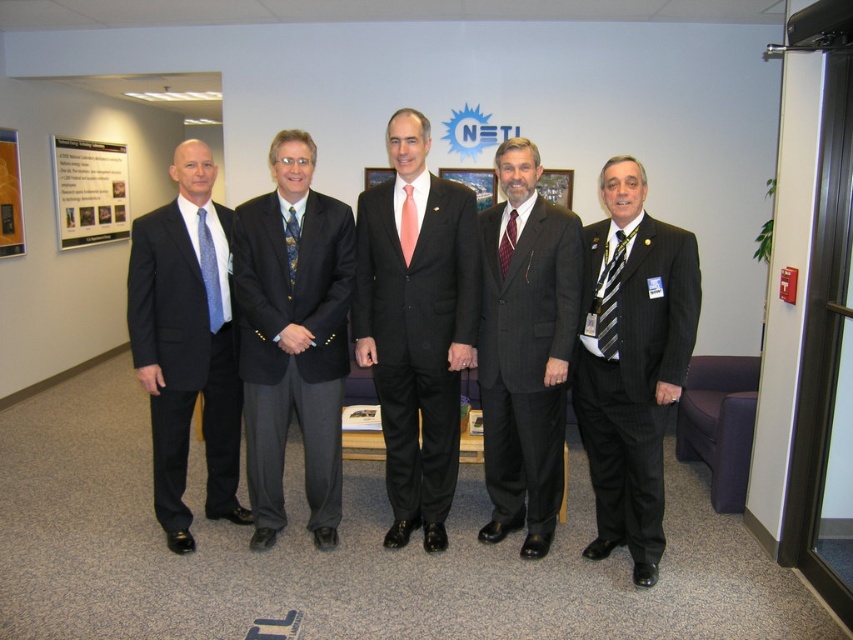
Does dark gray pinstripe suit at center have a lesser width compared to matte black suit at left?

Yes.

Between point (524, 230) and point (138, 305), which one is positioned behind?

The point (138, 305) is behind.

Find the location of a particular element. dark gray pinstripe suit at center is located at coordinates (526, 349).

Is point (634, 172) positioned before point (521, 211)?

Yes, point (634, 172) is closer to viewer.

The image size is (853, 640). In order to click on pinstripe suit at right in this screenshot , I will do `click(631, 362)`.

Does point (637, 237) come closer to viewer compared to point (537, 376)?

Yes, point (637, 237) is closer to viewer.

At what (x,y) coordinates should I click in order to perform the action: click on pinstripe suit at right. Please return your answer as a coordinate pair (x, y). This screenshot has height=640, width=853. Looking at the image, I should click on (631, 362).

Is point (392, 145) positioned in front of point (206, 248)?

Yes, point (392, 145) is in front of point (206, 248).

Where is `matte black suit at center`? Image resolution: width=853 pixels, height=640 pixels. matte black suit at center is located at coordinates (416, 326).

You are a GUI agent. You are given a task and a screenshot of the screen. Output one action in this format:
    pyautogui.click(x=<x>, y=<y>)
    Task: Click on the matte black suit at center
    This screenshot has height=640, width=853.
    Given the screenshot: What is the action you would take?
    pyautogui.click(x=416, y=326)